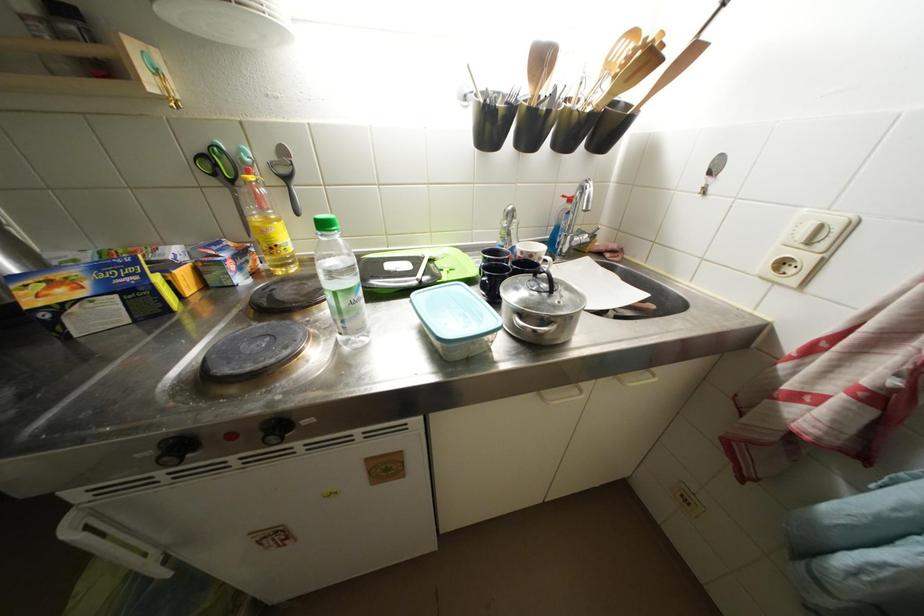
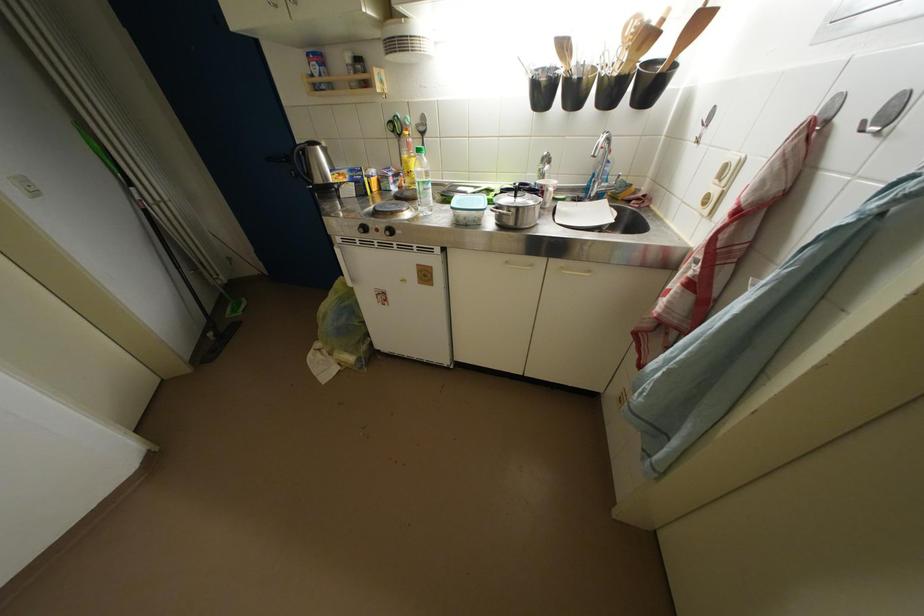
Locate, in the second image, the point that corresponds to [438,264] in the first image.

(495, 193)